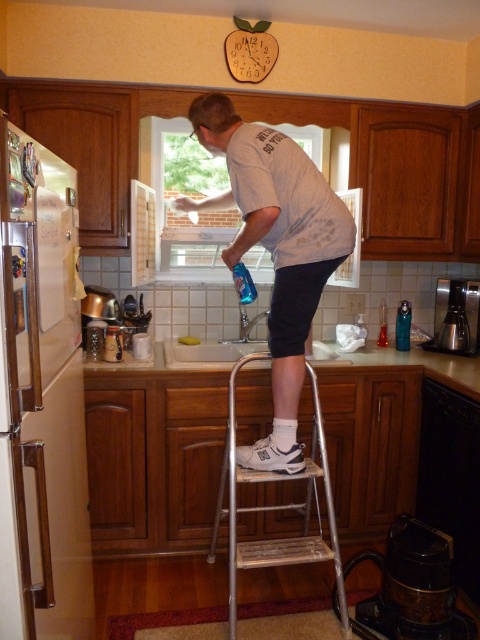
You are a kitchen assistant who needs to place a new spice jar on the tallest surface available. The white cotton shirt at center and the white glossy countertop at center are in your view. Which surface should you choose?

The white cotton shirt at center is much taller than the white glossy countertop at center, so you should place the spice jar on the white cotton shirt at center.

You are organizing the kitchen and need to place a new spice jar on the white glossy countertop at center. However, there is a white cotton shirt at center in the way. Based on their positions, which object should you move to make space?

The white cotton shirt at center is to the left of the white glossy countertop at center, so you should move the white cotton shirt at center to the right to make space for the spice jar.

You are organizing a kitchen event and need to place a decorative centerpiece on the white glossy countertop at center. The centerpiece is 1.2 meters wide. Can the white cotton shirt at center be moved to accommodate it?

The white cotton shirt at center has a lesser width compared to the white glossy countertop at center. Since the countertop is wider than the shirt, there should be enough space to move the shirt aside and place the 1.2 meter wide centerpiece on the white glossy countertop at center.